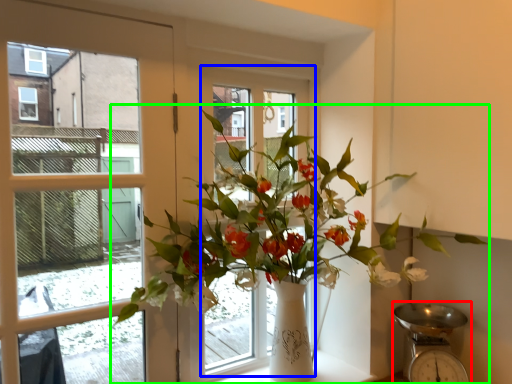
Question: Based on their relative distances, which object is nearer to scale (highlighted by a red box)? Choose from window frame (highlighted by a blue box) and houseplant (highlighted by a green box).

Choices:
 (A) window frame
 (B) houseplant

Answer: (B)